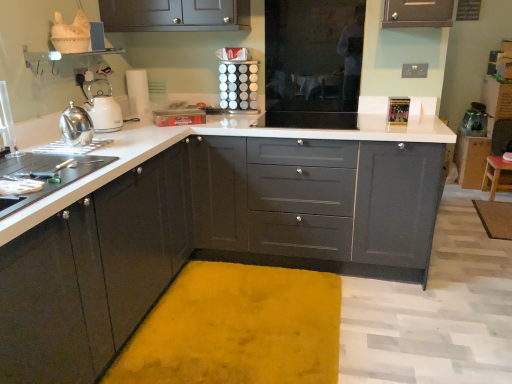
Question: From a real-world perspective, is yellow plush bath mat at center, positioned as the first bath mat in left-to-right order, positioned under matte black cabinets at left, the 3th cabinetry from the right, based on gravity?

Choices:
 (A) yes
 (B) no

Answer: (A)

Question: Does yellow plush bath mat at center, placed as the first bath mat when sorted from bottom to top, have a smaller size compared to matte black cabinets at left, the first cabinetry viewed from the front?

Choices:
 (A) no
 (B) yes

Answer: (B)

Question: Considering the relative sizes of yellow plush bath mat at center, acting as the second bath mat starting from the back, and matte black cabinets at left, the 3th cabinetry from the right, in the image provided, is yellow plush bath mat at center, acting as the second bath mat starting from the back, wider than matte black cabinets at left, the 3th cabinetry from the right,?

Choices:
 (A) no
 (B) yes

Answer: (B)

Question: From the image's perspective, is yellow plush bath mat at center, positioned as the first bath mat in left-to-right order, over matte black cabinets at left, the first cabinetry viewed from the front?

Choices:
 (A) no
 (B) yes

Answer: (A)

Question: From the image's perspective, is yellow plush bath mat at center, positioned as the first bath mat in left-to-right order, under matte black cabinets at left, which is the first cabinetry in left-to-right order?

Choices:
 (A) no
 (B) yes

Answer: (B)

Question: From a real-world perspective, relative to white glossy countertop at center, is metallic silver spice rack at upper center vertically above or below?

Choices:
 (A) below
 (B) above

Answer: (B)

Question: Would you say metallic silver spice rack at upper center is inside or outside white glossy countertop at center?

Choices:
 (A) outside
 (B) inside

Answer: (A)

Question: From the image's perspective, relative to white glossy countertop at center, is metallic silver spice rack at upper center above or below?

Choices:
 (A) above
 (B) below

Answer: (A)

Question: In the image, is metallic silver spice rack at upper center positioned in front of or behind white glossy countertop at center?

Choices:
 (A) behind
 (B) front

Answer: (A)

Question: Does point (482, 188) appear closer or farther from the camera than point (459, 137)?

Choices:
 (A) closer
 (B) farther

Answer: (A)

Question: Looking at their shapes, would you say wooden stool at lower right is wider or thinner than matte gray cabinet at right, which is counted as the 3th cabinetry, starting from the left?

Choices:
 (A) thin
 (B) wide

Answer: (A)

Question: Do you think wooden stool at lower right is within matte gray cabinet at right, arranged as the third cabinetry when viewed from the front, or outside of it?

Choices:
 (A) outside
 (B) inside

Answer: (A)

Question: Considering the positions of wooden stool at lower right and matte gray cabinet at right, which is counted as the 3th cabinetry, starting from the left, in the image, is wooden stool at lower right taller or shorter than matte gray cabinet at right, which is counted as the 3th cabinetry, starting from the left,?

Choices:
 (A) short
 (B) tall

Answer: (A)

Question: Does point (463, 142) appear closer or farther from the camera than point (97, 362)?

Choices:
 (A) farther
 (B) closer

Answer: (A)

Question: In terms of height, does matte gray cabinet at right, which is counted as the 3th cabinetry, starting from the left, look taller or shorter compared to matte black cabinets at left, the first cabinetry viewed from the front?

Choices:
 (A) short
 (B) tall

Answer: (A)